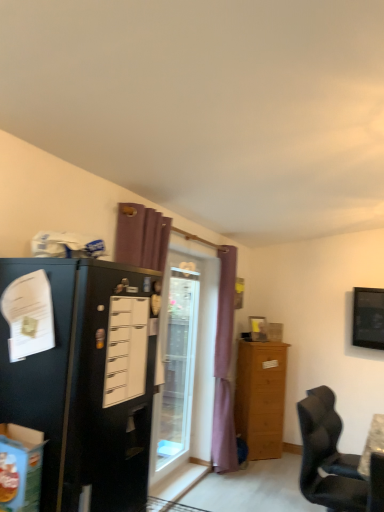
This screenshot has width=384, height=512. Describe the element at coordinates (88, 381) in the screenshot. I see `black matte refrigerator at left` at that location.

At what (x,y) coordinates should I click in order to perform the action: click on green cardboard box at lower left. Please return your answer as a coordinate pair (x, y). Looking at the image, I should click on (20, 468).

Locate an element on the screen. purple fabric curtain at center is located at coordinates [224, 367].

This screenshot has width=384, height=512. I want to click on black glossy tv at upper right, so click(368, 318).

What do you see at coordinates (368, 318) in the screenshot? The height and width of the screenshot is (512, 384). I see `black glossy tv at upper right` at bounding box center [368, 318].

What do you see at coordinates (126, 349) in the screenshot? I see `white matte drawer at left` at bounding box center [126, 349].

Where is `wooden picture frame at upper center`? wooden picture frame at upper center is located at coordinates (258, 328).

Which is further, (x=265, y=338) or (x=149, y=442)?

The point (x=265, y=338) is farther from the camera.

Which object is positioned more to the right, wooden picture frame at upper center or black matte refrigerator at left?

Positioned to the right is wooden picture frame at upper center.

Does wooden picture frame at upper center have a smaller size compared to black matte refrigerator at left?

Indeed, wooden picture frame at upper center has a smaller size compared to black matte refrigerator at left.

In the scene shown: Can you tell me how much wooden picture frame at upper center and black matte refrigerator at left differ in facing direction?

36.2 degrees.

From a real-world perspective, between white matte drawer at left and black leather chair at lower right, who is vertically higher?

white matte drawer at left is physically above.

From the image's perspective, between white matte drawer at left and black leather chair at lower right, which one is located above?

From the image's view, white matte drawer at left is above.

Which of these two, white matte drawer at left or black leather chair at lower right, is bigger?

With larger size is black leather chair at lower right.

From a real-world perspective, is light brown wooden cabinet at right under transparent glass door at center?

Yes, from a real-world perspective, light brown wooden cabinet at right is beneath transparent glass door at center.

Does light brown wooden cabinet at right have a greater height compared to transparent glass door at center?

No, light brown wooden cabinet at right is not taller than transparent glass door at center.

Is light brown wooden cabinet at right facing away from transparent glass door at center?

No, light brown wooden cabinet at right is not facing away from transparent glass door at center.

Between light brown wooden cabinet at right and transparent glass door at center, which one has smaller size?

transparent glass door at center is smaller.

Where is `drawer behind the green cardboard box at lower left`? drawer behind the green cardboard box at lower left is located at coordinates (126, 349).

Is green cardboard box at lower left situated inside white matte drawer at left or outside?

The correct answer is: outside.

From a real-world perspective, between green cardboard box at lower left and white matte drawer at left, who is vertically higher?

From a 3D spatial view, white matte drawer at left is above.

Is green cardboard box at lower left oriented towards white matte drawer at left?

No, green cardboard box at lower left does not turn towards white matte drawer at left.

In terms of size, does green cardboard box at lower left appear bigger or smaller than purple fabric curtain at center?

In the image, green cardboard box at lower left appears to be smaller than purple fabric curtain at center.

Is green cardboard box at lower left wider or thinner than purple fabric curtain at center?

Clearly, green cardboard box at lower left has less width compared to purple fabric curtain at center.

What's the angular difference between green cardboard box at lower left and purple fabric curtain at center's facing directions?

The angle between the facing direction of green cardboard box at lower left and the facing direction of purple fabric curtain at center is 95.7 degrees.

Does green cardboard box at lower left come in front of purple fabric curtain at center?

Yes.

Is white matte drawer at left facing towards black glossy tv at upper right?

No, white matte drawer at left is not oriented towards black glossy tv at upper right.

Which is in front, point (111, 298) or point (367, 288)?

The point (111, 298) is closer to the camera.

Is white matte drawer at left far from black glossy tv at upper right?

Yes, white matte drawer at left and black glossy tv at upper right are quite far apart.

Is white matte drawer at left wider or thinner than black glossy tv at upper right?

white matte drawer at left is thinner than black glossy tv at upper right.

From a real-world perspective, who is located lower, wooden picture frame at upper center or light brown wooden cabinet at right?

In real-world perspective, light brown wooden cabinet at right is lower.

In the scene shown: From the image's perspective, is wooden picture frame at upper center above light brown wooden cabinet at right?

Yes, from the image's perspective, wooden picture frame at upper center is above light brown wooden cabinet at right.

Considering their positions, is wooden picture frame at upper center located in front of or behind light brown wooden cabinet at right?

In the image, wooden picture frame at upper center appears behind light brown wooden cabinet at right.

The height and width of the screenshot is (512, 384). I want to click on refrigerator located on the left of wooden picture frame at upper center, so click(261, 397).

In the image, there is a black matte refrigerator at left. In order to click on picture frame below it (from the image's perspective) in this screenshot , I will do `click(258, 328)`.

At what (x,y) coordinates should I click in order to perform the action: click on drawer on the left of black leather chair at lower right. Please return your answer as a coordinate pair (x, y). Image resolution: width=384 pixels, height=512 pixels. Looking at the image, I should click on (126, 349).

When comparing their distances from purple fabric curtain at center, does black glossy tv at upper right or black matte refrigerator at left seem further?

The object further to purple fabric curtain at center is black matte refrigerator at left.

Based on their spatial positions, is black matte refrigerator at left or green cardboard box at lower left further from transparent glass door at center?

green cardboard box at lower left is further to transparent glass door at center.

Considering their positions, is white matte drawer at left positioned closer to black matte refrigerator at left than transparent glass door at center?

white matte drawer at left is closer to black matte refrigerator at left.

From the image, which object appears to be nearer to wooden picture frame at upper center, green cardboard box at lower left or black leather chair at lower right?

Based on the image, black leather chair at lower right appears to be nearer to wooden picture frame at upper center.

From the image, which object appears to be farther from wooden picture frame at upper center, white matte drawer at left or black matte refrigerator at left?

black matte refrigerator at left lies further to wooden picture frame at upper center than the other object.

Estimate the real-world distances between objects in this image. Which object is closer to purple fabric curtain at center, white matte drawer at left or wooden picture frame at upper center?

wooden picture frame at upper center is positioned closer to the anchor purple fabric curtain at center.

From the image, which object appears to be farther from black matte refrigerator at left, white matte drawer at left or black glossy tv at upper right?

black glossy tv at upper right.

Based on the photo, based on their spatial positions, is transparent glass door at center or wooden picture frame at upper center further from white matte drawer at left?

wooden picture frame at upper center is positioned further to the anchor white matte drawer at left.

You are a GUI agent. You are given a task and a screenshot of the screen. Output one action in this format:
    pyautogui.click(x=<x>, y=<y>)
    Task: Click on the refrigerator positioned between transparent glass door at center and wooden picture frame at upper center from near to far
    This screenshot has width=384, height=512.
    Given the screenshot: What is the action you would take?
    pyautogui.click(x=261, y=397)

Find the location of a particular element. This screenshot has height=512, width=384. chair between transparent glass door at center and black glossy tv at upper right in the horizontal direction is located at coordinates (326, 460).

I want to click on drawer between black matte refrigerator at left and transparent glass door at center from front to back, so (126, 349).

The image size is (384, 512). Find the location of `chair between black matte refrigerator at left and light brown wooden cabinet at right in the front-back direction`. chair between black matte refrigerator at left and light brown wooden cabinet at right in the front-back direction is located at coordinates (326, 460).